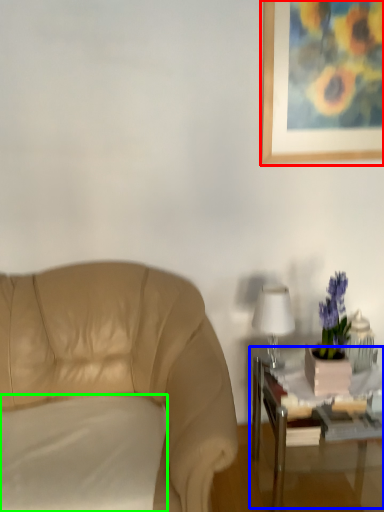
Question: Which is farther away from picture frame (highlighted by a red box)? table (highlighted by a blue box) or pillow (highlighted by a green box)?

Choices:
 (A) table
 (B) pillow

Answer: (B)